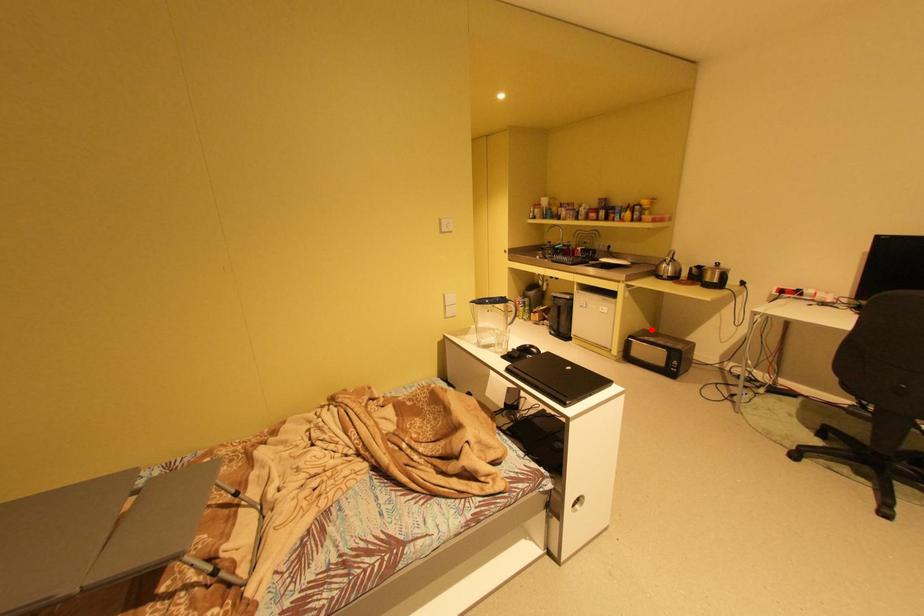
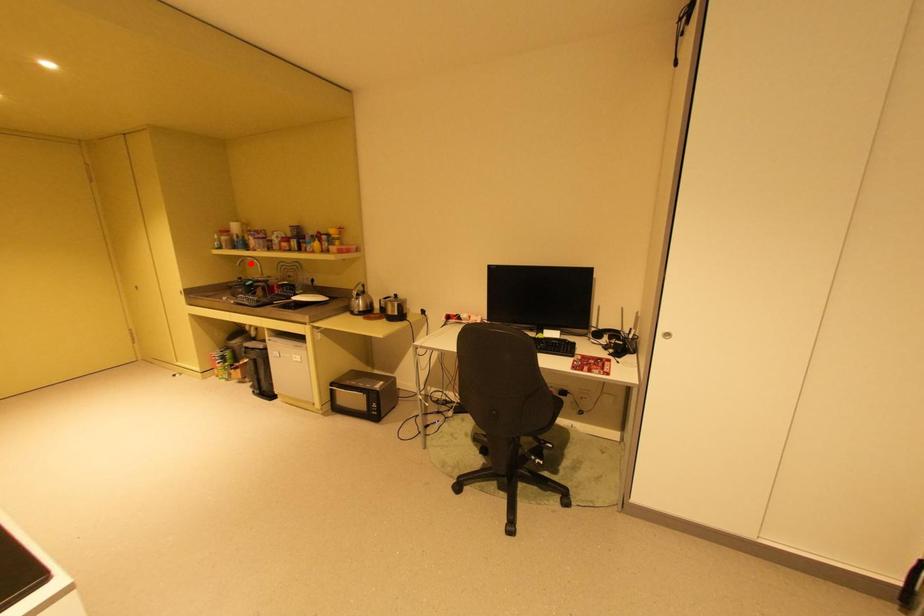
I am providing you with two images of the same scene from different viewpoints. A red point is marked on the first image and another point is marked on the second image. Is the marked point in image1 the same physical position as the marked point in image2?

No